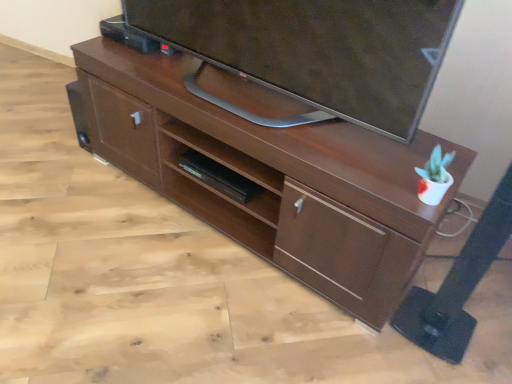
I want to click on vacant area that is in front of brown wood desk at center, so click(208, 312).